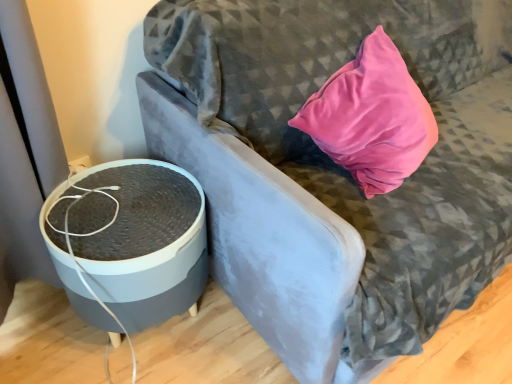
Question: Do you think matte gray speaker at left is within matte gray round table at left, or outside of it?

Choices:
 (A) outside
 (B) inside

Answer: (A)

Question: Based on their positions, is matte gray speaker at left located to the left or right of matte gray round table at left?

Choices:
 (A) left
 (B) right

Answer: (B)

Question: Considering the positions of matte gray speaker at left and matte gray round table at left in the image, is matte gray speaker at left taller or shorter than matte gray round table at left?

Choices:
 (A) tall
 (B) short

Answer: (A)

Question: Would you say matte gray round table at left is to the left or to the right of matte gray speaker at left in the picture?

Choices:
 (A) left
 (B) right

Answer: (A)

Question: From the image's perspective, is matte gray round table at left located above or below matte gray speaker at left?

Choices:
 (A) above
 (B) below

Answer: (B)

Question: Is matte gray round table at left wider or thinner than matte gray speaker at left?

Choices:
 (A) wide
 (B) thin

Answer: (B)

Question: From a real-world perspective, is matte gray round table at left physically located above or below matte gray speaker at left?

Choices:
 (A) above
 (B) below

Answer: (B)